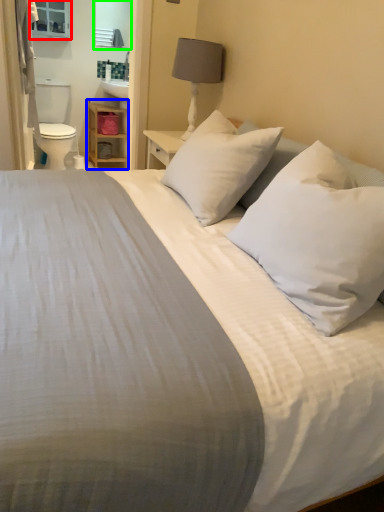
Question: Which object is the farthest from medicine cabinet (highlighted by a red box)? Choose among these: dresser (highlighted by a blue box) or mirror (highlighted by a green box).

Choices:
 (A) dresser
 (B) mirror

Answer: (A)